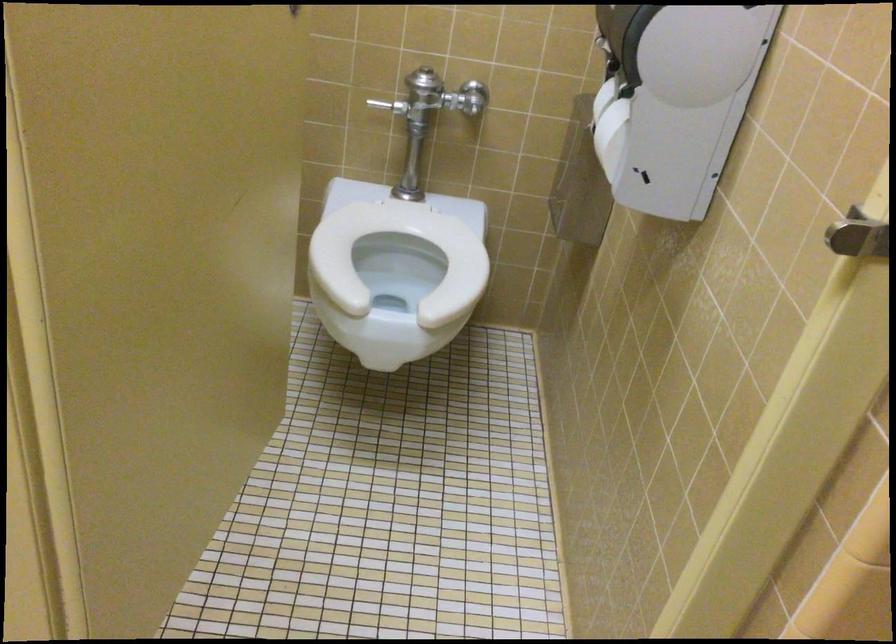
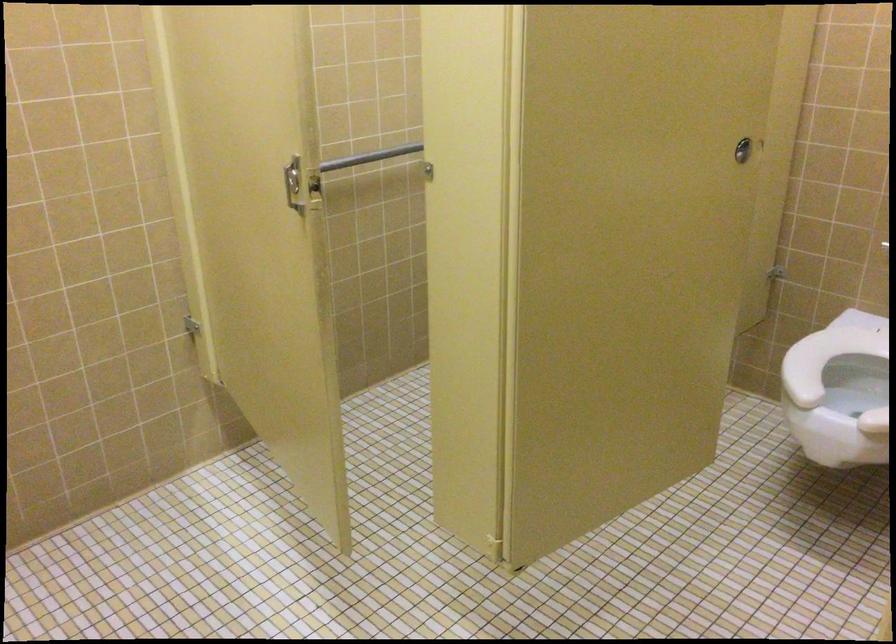
Where in the second image is the point corresponding to point (346, 256) from the first image?

(836, 362)